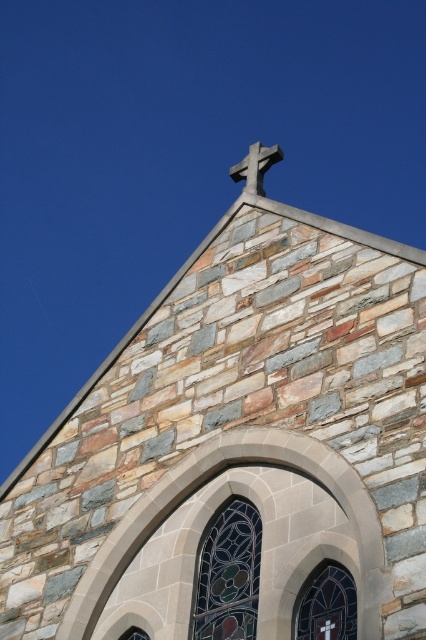
Between stained glass window at center and stained glass window at upper center, which one has more height?

Standing taller between the two is stained glass window at center.

Can you confirm if stained glass window at center is positioned to the left of stained glass window at upper center?

Yes, stained glass window at center is to the left of stained glass window at upper center.

Does point (236, 531) lie in front of point (328, 572)?

No, it is behind (328, 572).

Find the location of a particular element. The width and height of the screenshot is (426, 640). stained glass window at center is located at coordinates (229, 576).

From the picture: Who is higher up, stained glass window at center or white stone cross at upper center?

Positioned higher is white stone cross at upper center.

Who is lower down, stained glass window at center or white stone cross at upper center?

stained glass window at center

Measure the distance between point [244,634] and camera.

A distance of 28.48 meters exists between point [244,634] and camera.

The height and width of the screenshot is (640, 426). I want to click on stained glass window at center, so coord(229,576).

Is stained glass window at upper center positioned behind white stone cross at upper center?

No.

Is stained glass window at upper center above white stone cross at upper center?

Incorrect, stained glass window at upper center is not positioned above white stone cross at upper center.

At what (x,y) coordinates should I click in order to perform the action: click on stained glass window at upper center. Please return your answer as a coordinate pair (x, y). The width and height of the screenshot is (426, 640). Looking at the image, I should click on (327, 604).

Identify the location of stained glass window at upper center. (327, 604).